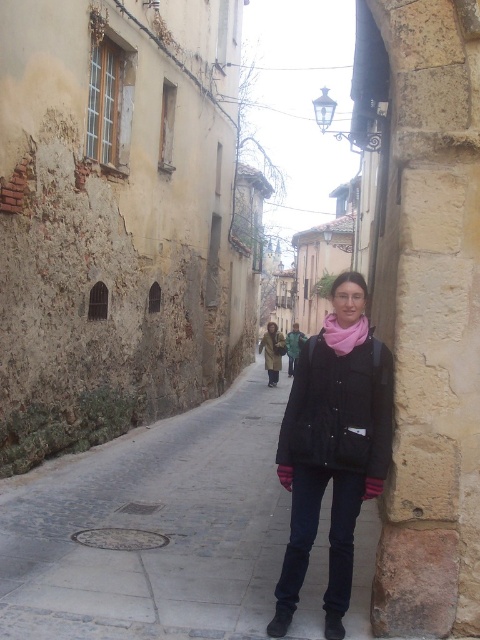
Can you confirm if pink soft scarf at center is shorter than brown leather boot at lower center?

Incorrect, pink soft scarf at center's height does not fall short of brown leather boot at lower center's.

The image size is (480, 640). Find the location of `pink soft scarf at center`. pink soft scarf at center is located at coordinates (344, 333).

Can you confirm if gray concrete pavement at center is taller than matte brown coat at center?

No.

Where is `gray concrete pavement at center`? The height and width of the screenshot is (640, 480). gray concrete pavement at center is located at coordinates (153, 529).

Identify the location of gray concrete pavement at center. The width and height of the screenshot is (480, 640). (153, 529).

In the scene shown: Is black matte jacket at center taller than brown suede boot at lower center?

Yes.

Is black matte jacket at center to the left of brown suede boot at lower center from the viewer's perspective?

In fact, black matte jacket at center is to the right of brown suede boot at lower center.

Locate an element on the screen. The height and width of the screenshot is (640, 480). black matte jacket at center is located at coordinates coord(333,456).